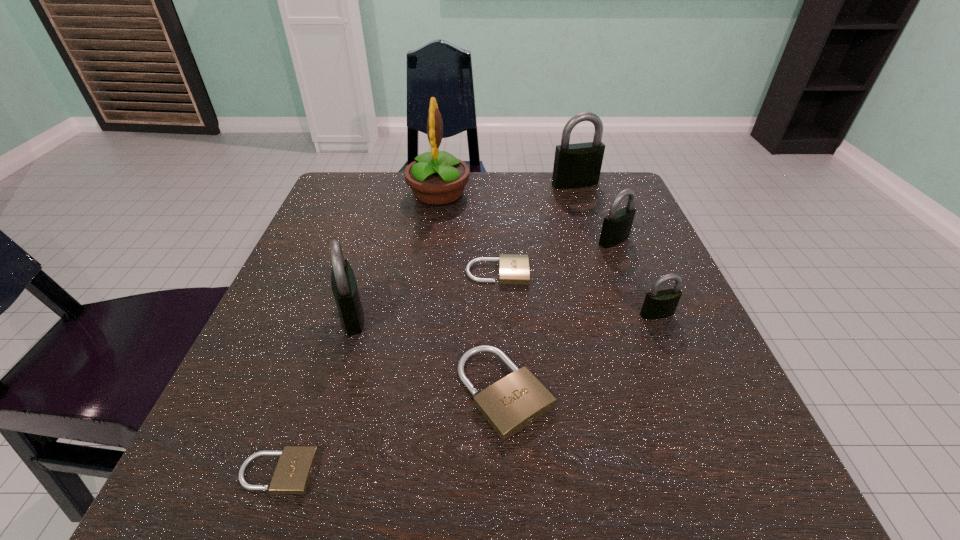
This screenshot has width=960, height=540. I want to click on sunflower, so click(437, 178).

Locate an element on the screen. The width and height of the screenshot is (960, 540). the tallest object is located at coordinates (437, 178).

The image size is (960, 540). What are the coordinates of `the farthest padlock` in the screenshot? It's located at (578, 165).

Locate an element on the screen. the tallest padlock is located at coordinates (578, 165).

Find the location of `the third tallest object`. the third tallest object is located at coordinates (343, 282).

Where is `the leftmost black padlock`? the leftmost black padlock is located at coordinates (343, 282).

At what (x,y) coordinates should I click in order to perform the action: click on the fourth tallest object. Please return your answer as a coordinate pair (x, y). The height and width of the screenshot is (540, 960). Looking at the image, I should click on (616, 228).

Identify the location of the sixth nearest padlock. The image size is (960, 540). (616, 228).

This screenshot has width=960, height=540. In order to click on the smallest black padlock in this screenshot , I will do `click(660, 304)`.

This screenshot has width=960, height=540. I want to click on the fourth shortest padlock, so [660, 304].